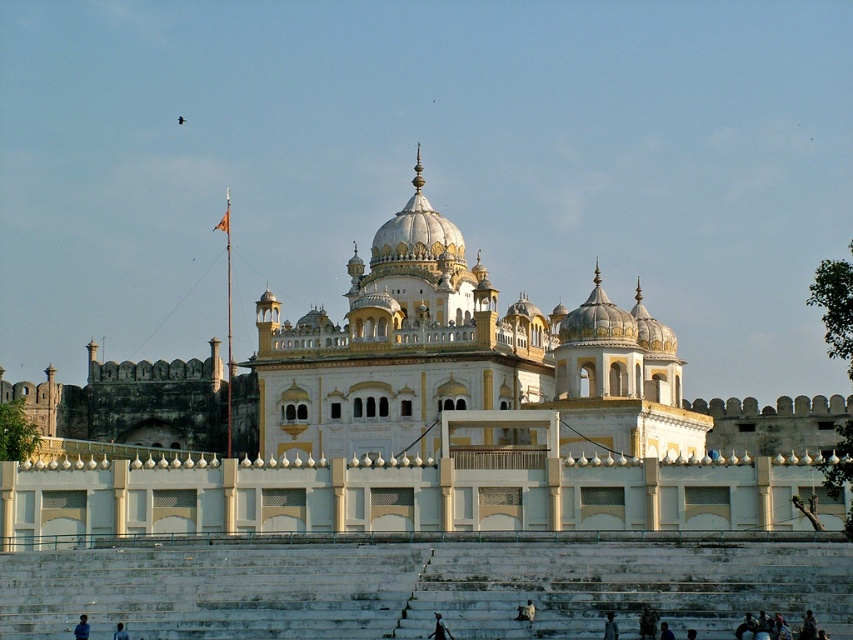
Is white marble palace at center shorter than white stone stairs at center?

No.

Measure the distance between white marble palace at center and white stone stairs at center.

A distance of 53.37 feet exists between white marble palace at center and white stone stairs at center.

Describe the element at coordinates (436, 420) in the screenshot. I see `white marble palace at center` at that location.

Find the location of a particular element. The width and height of the screenshot is (853, 640). white marble palace at center is located at coordinates (436, 420).

Is white marble palace at center further to the viewer compared to dark blue fabric at lower left?

Yes, it is behind dark blue fabric at lower left.

Is white marble palace at center taller than dark blue fabric at lower left?

Indeed, white marble palace at center has a greater height compared to dark blue fabric at lower left.

Is point (410, 412) in front of point (125, 637)?

No, it is not.

I want to click on white marble palace at center, so tap(436, 420).

Does white stone stairs at center have a smaller size compared to black fabric person at lower center?

No, white stone stairs at center is not smaller than black fabric person at lower center.

Does white stone stairs at center have a lesser height compared to black fabric person at lower center?

No, white stone stairs at center is not shorter than black fabric person at lower center.

The image size is (853, 640). What are the coordinates of `white stone stairs at center` in the screenshot? It's located at (421, 588).

Identify the location of white stone stairs at center. The height and width of the screenshot is (640, 853). (421, 588).